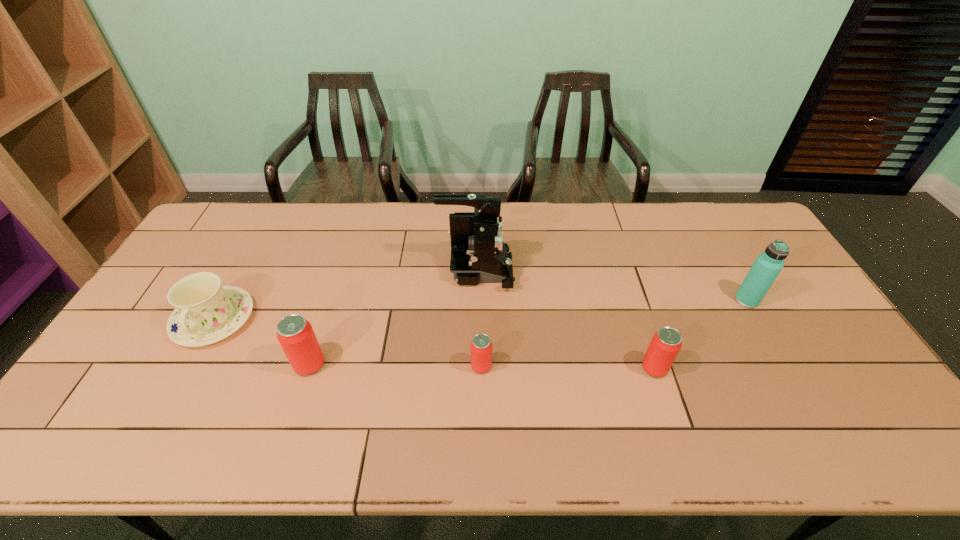
Image resolution: width=960 pixels, height=540 pixels. Identify the location of free point that keeps the beer cans evenly spaced on the right. (828, 370).